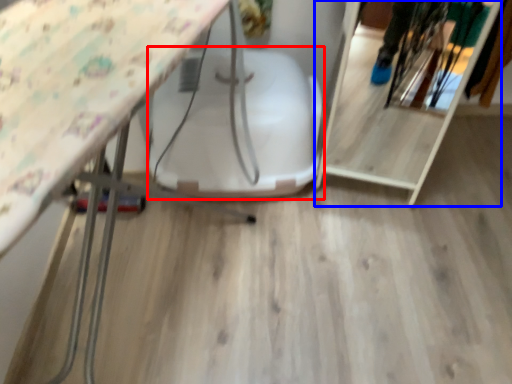
Question: Which of the following is the closest to the observer, swivel chair (highlighted by a red box) or shelf (highlighted by a blue box)?

Choices:
 (A) swivel chair
 (B) shelf

Answer: (B)